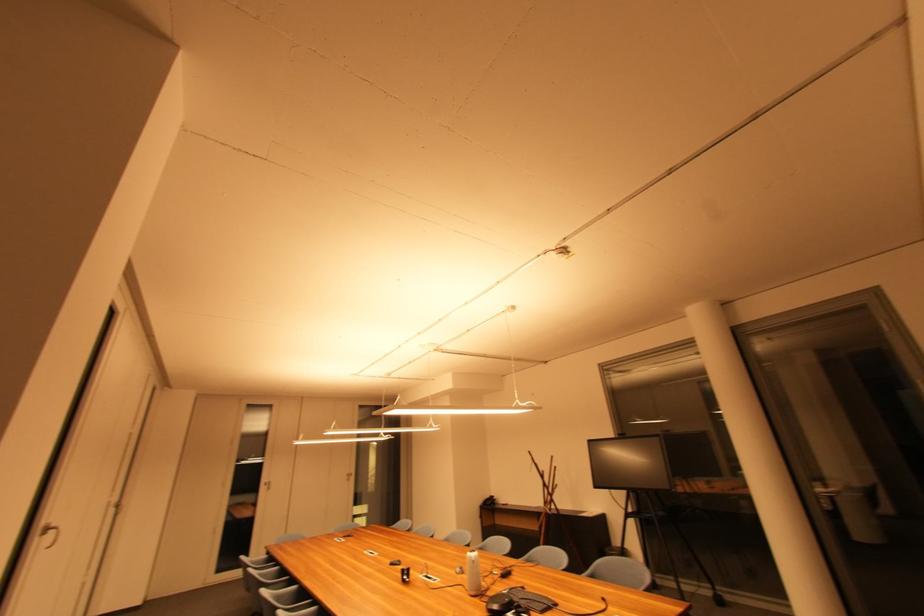
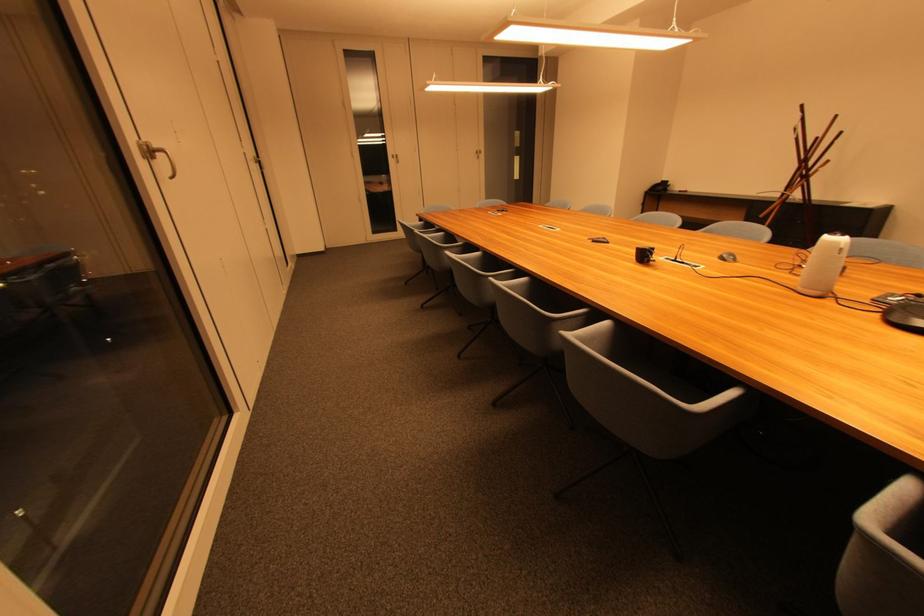
The point at (477, 560) is marked in the first image. Where is the corresponding point in the second image?

(841, 245)